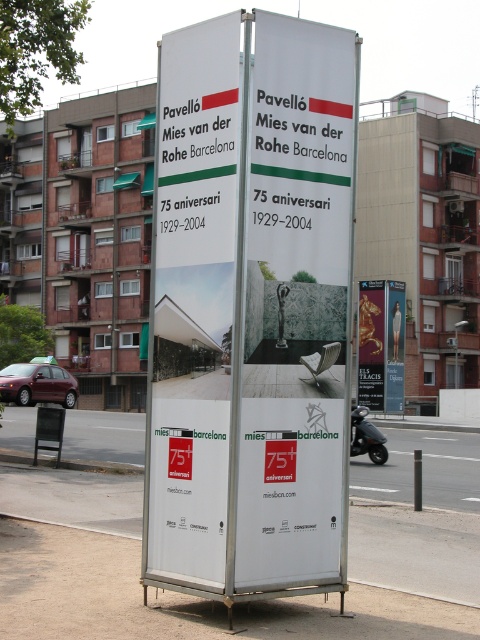
You are a city planner assessing the space in front of the advertisement sign. You need to determine if the gold metallic statue at center can be placed next to the metallic bus stop at lower left without blocking pedestrian pathways. Based on their widths, can they be placed side by side?

The gold metallic statue at center might be wider than metallic bus stop at lower left, so there is uncertainty about whether they can be placed side by side without blocking pedestrian pathways. Further measurement or confirmation is needed.

You are a pedestrian standing in front of the advertisement sign. You see the white paper billboard at center and the metallic bus stop at lower left. Which object is located to the right of the other?

The white paper billboard at center is positioned on the right side of metallic bus stop at lower left, so the white paper billboard at center is to the right of the metallic bus stop at lower left.